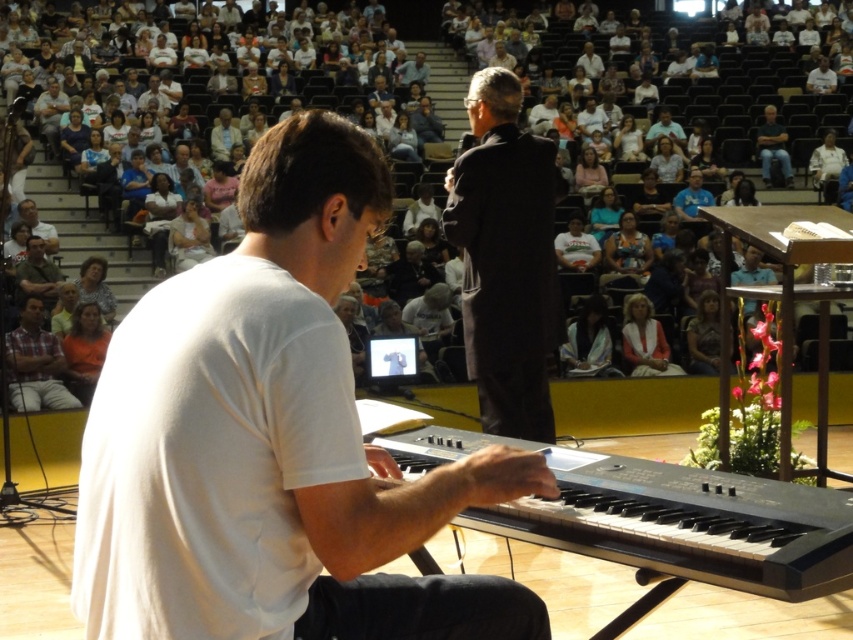
You are a performer standing on stage and you see the white cloth crowd at upper center and the dark brown leather jacket at center in the audience. Which object is closer to you, the performer?

The dark brown leather jacket at center is closer to you than the white cloth crowd at upper center because the distance between them is 5.01 feet, meaning the jacket is nearer to the stage.

You are sitting in the audience watching the keyboard player. There are two points marked in the image. Which point is closer to you, point (68, 250) or point (666, 204)?

Point (68, 250) is closer to the viewer than point (666, 204).